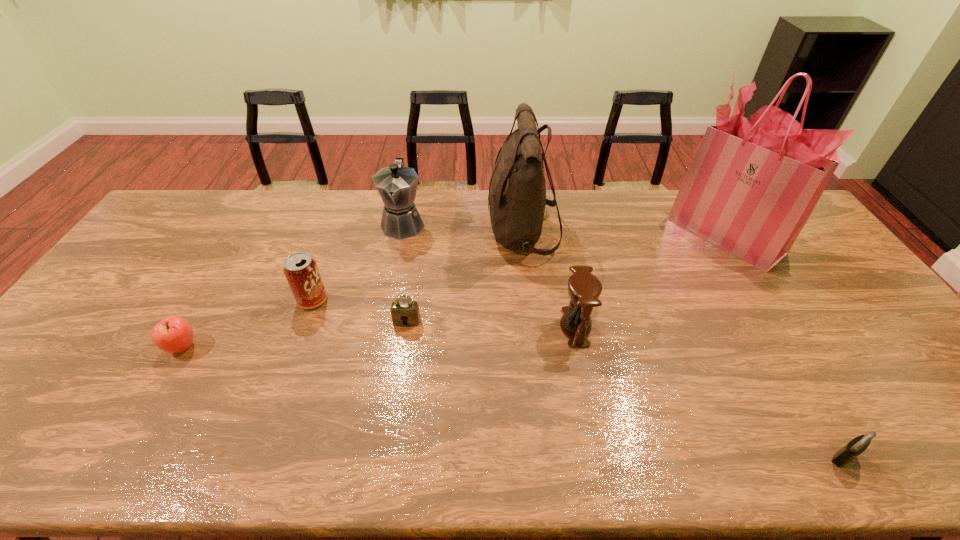
Image resolution: width=960 pixels, height=540 pixels. Find the location of `free space between the nearest object and the hourglass`. free space between the nearest object and the hourglass is located at coordinates (709, 392).

Find the location of a particular element. free space between the backpack and the apple is located at coordinates (352, 289).

The height and width of the screenshot is (540, 960). What are the coordinates of `free space between the coffeepot and the farther padlock` in the screenshot? It's located at (405, 272).

Identify the location of vacant space in between the coffeepot and the left padlock. This screenshot has width=960, height=540. (405, 272).

Locate an element on the screen. The image size is (960, 540). free spot between the third tallest object and the tallest object is located at coordinates (564, 229).

Find the location of a particular element. free area in between the farther padlock and the coffeepot is located at coordinates (405, 272).

The image size is (960, 540). I want to click on free spot between the apple and the second object from left to right, so click(248, 323).

You are a GUI agent. You are given a task and a screenshot of the screen. Output one action in this format:
    pyautogui.click(x=<x>, y=<y>)
    Task: Click on the vacant space that is in between the shopping bag and the nearest object
    The image size is (960, 540).
    Given the screenshot: What is the action you would take?
    pyautogui.click(x=784, y=346)

Find the location of a particular element. free area in between the soda can and the hourglass is located at coordinates (444, 314).

Find the location of a particular element. This screenshot has height=540, width=960. object that is the fourth closest to the left padlock is located at coordinates (584, 288).